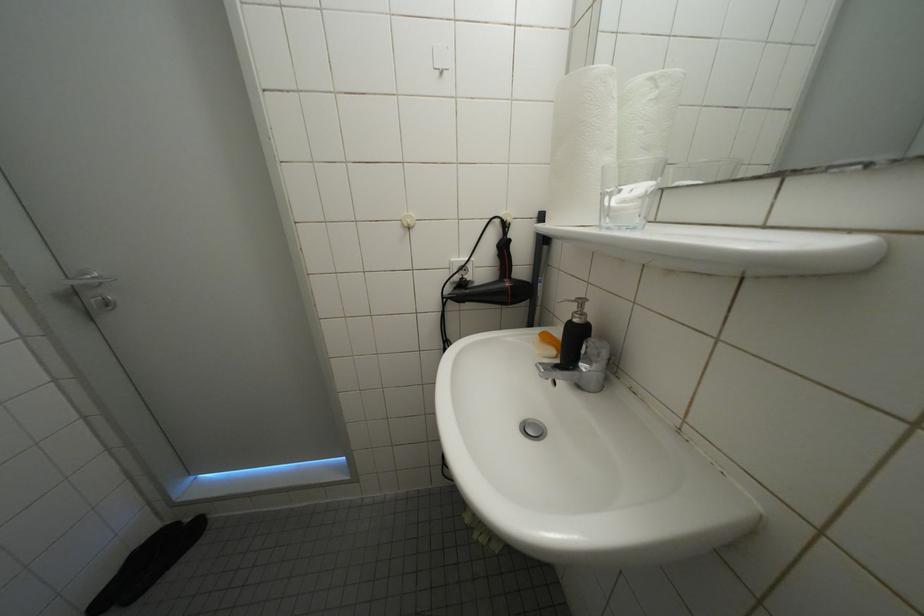
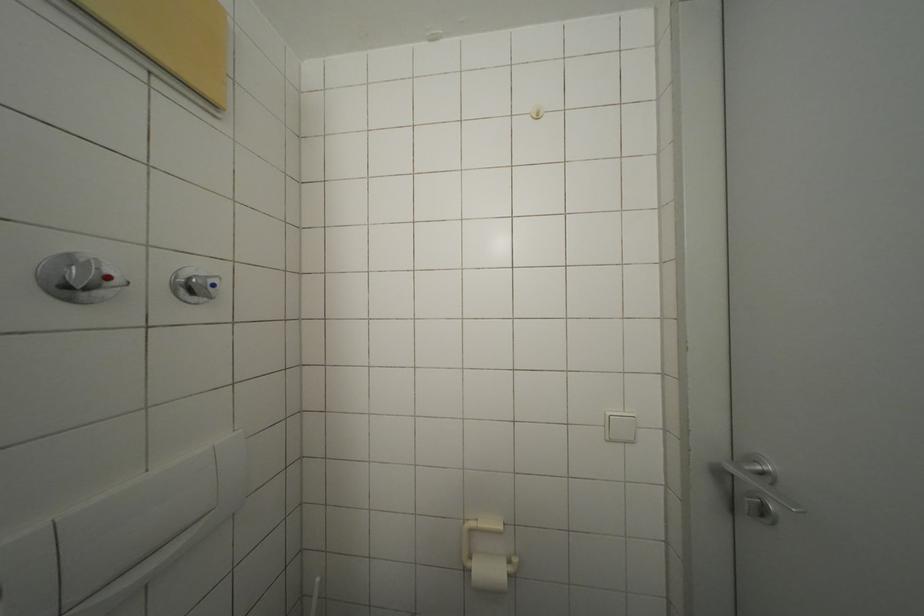
Question: The first image is from the beginning of the video and the second image is from the end. How did the camera likely rotate when shooting the video?

Choices:
 (A) Left
 (B) Right
 (C) Up
 (D) Down

Answer: (A)